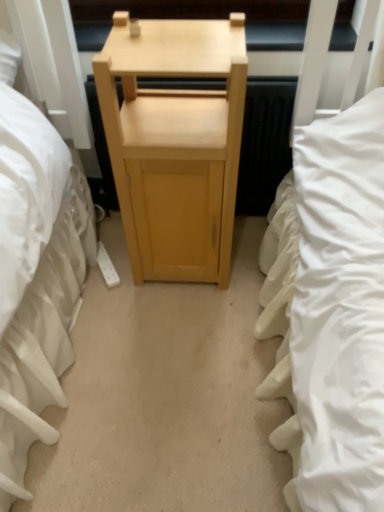
What are the coordinates of `vacant space to the left of light wood nightstand at center` in the screenshot? It's located at (107, 282).